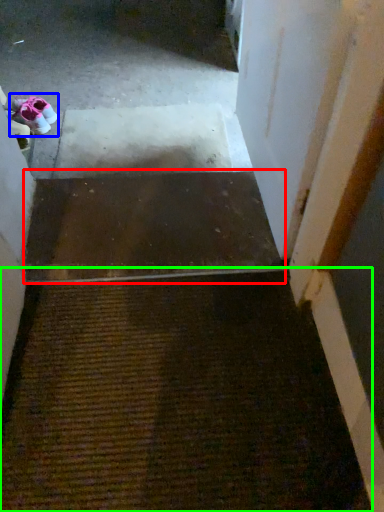
Question: Considering the real-world distances, which object is farthest from stairs (highlighted by a red box)? footwear (highlighted by a blue box) or doormat (highlighted by a green box)?

Choices:
 (A) footwear
 (B) doormat

Answer: (A)